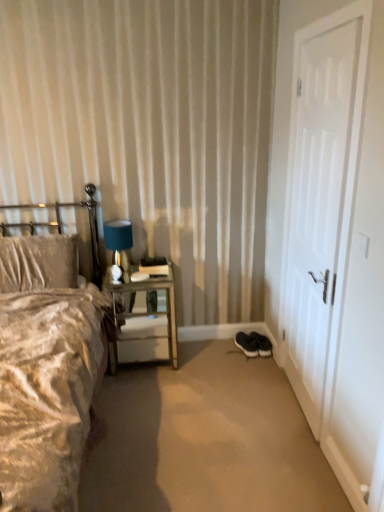
Identify the location of free space in front of white matte door at right. This screenshot has height=512, width=384. (287, 446).